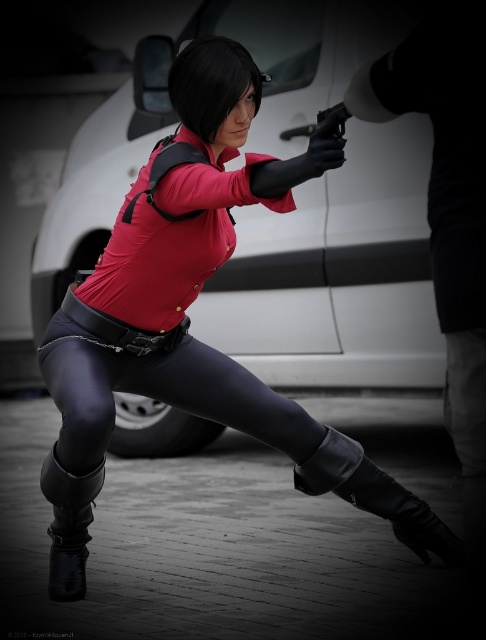
Question: Does black leather boot at lower left appear on the left side of black rubber gun at center?

Choices:
 (A) no
 (B) yes

Answer: (B)

Question: Considering the real-world distances, which object is closest to the black leather boot at lower center?

Choices:
 (A) black rubber gun at center
 (B) black leather boot at lower left
 (C) black leather leggings at center

Answer: (C)

Question: Is black leather boot at lower center to the right of black leather boot at lower left from the viewer's perspective?

Choices:
 (A) yes
 (B) no

Answer: (A)

Question: Considering the real-world distances, which object is closest to the black leather boot at lower center?

Choices:
 (A) black leather boot at lower left
 (B) black leather leggings at center
 (C) black rubber gun at center

Answer: (B)

Question: Is black leather boot at lower left smaller than black rubber gun at center?

Choices:
 (A) yes
 (B) no

Answer: (B)

Question: Which point is farther to the camera?

Choices:
 (A) (343, 106)
 (B) (260, 388)
 (C) (417, 548)
 (D) (58, 534)

Answer: (C)